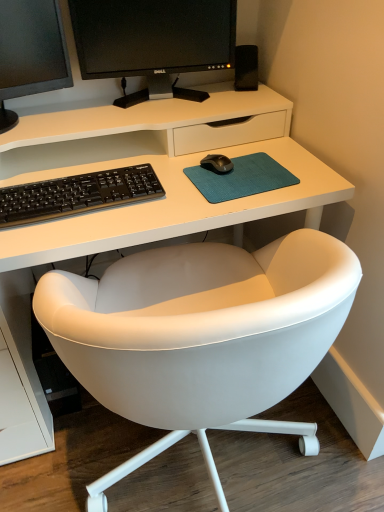
From the picture: What is the approximate height of black glossy monitor at upper left, the first computer monitor in the left-to-right sequence?

The height of black glossy monitor at upper left, the first computer monitor in the left-to-right sequence, is 12.03 inches.

Measure the distance between point (18,7) and camera.

The distance of point (18,7) from camera is 3.48 feet.

The image size is (384, 512). I want to click on teal fabric mousepad at center, so click(x=241, y=178).

At what (x,y) coordinates should I click in order to perform the action: click on white leather chair at center. Please return your answer as a coordinate pair (x, y). Looking at the image, I should click on (201, 336).

Image resolution: width=384 pixels, height=512 pixels. In order to click on black matte keyboard at center in this screenshot , I will do `click(77, 194)`.

Is black matte keyboard at center with teal fabric mousepad at center?

No.

From their relative heights in the image, would you say black matte keyboard at center is taller or shorter than teal fabric mousepad at center?

Considering their sizes, black matte keyboard at center has more height than teal fabric mousepad at center.

Can you confirm if black matte keyboard at center is bigger than teal fabric mousepad at center?

Correct, black matte keyboard at center is larger in size than teal fabric mousepad at center.

From the image's perspective, is black matte keyboard at center on teal fabric mousepad at center?

No.

From a real-world perspective, is black glossy monitor at upper left, which is counted as the second computer monitor, starting from the right, physically located above or below teal fabric mousepad at center?

black glossy monitor at upper left, which is counted as the second computer monitor, starting from the right, is above teal fabric mousepad at center.

From the image's perspective, which computer monitor is the 1st one above the teal fabric mousepad at center? Please provide its 2D coordinates.

[(30, 52)]

How many degrees apart are the facing directions of black glossy monitor at upper left, which is counted as the second computer monitor, starting from the right, and teal fabric mousepad at center?

10.8 degrees separate the facing orientations of black glossy monitor at upper left, which is counted as the second computer monitor, starting from the right, and teal fabric mousepad at center.

Between point (55, 70) and point (270, 165), which one is positioned behind?

The point (55, 70) is farther.

Could you tell me if black matte speaker at upper right is turned towards teal fabric mousepad at center?

Yes, black matte speaker at upper right is aimed at teal fabric mousepad at center.

Which is correct: black matte speaker at upper right is inside teal fabric mousepad at center, or outside of it?

black matte speaker at upper right is outside teal fabric mousepad at center.

In the scene shown: Which of these two, black matte speaker at upper right or teal fabric mousepad at center, stands shorter?

Standing shorter between the two is teal fabric mousepad at center.

Is black glossy monitor at upper left, which is counted as the second computer monitor, starting from the right, behind black glossy monitor at upper center, marked as the 1th computer monitor in a right-to-left arrangement?

That is False.

Considering the sizes of objects black glossy monitor at upper left, the first computer monitor in the left-to-right sequence, and black glossy monitor at upper center, marked as the 1th computer monitor in a right-to-left arrangement, in the image provided, who is bigger, black glossy monitor at upper left, the first computer monitor in the left-to-right sequence, or black glossy monitor at upper center, marked as the 1th computer monitor in a right-to-left arrangement,?

With larger size is black glossy monitor at upper left, the first computer monitor in the left-to-right sequence.

Would you say black glossy monitor at upper left, which is counted as the second computer monitor, starting from the right, contains black glossy monitor at upper center, arranged as the 2th computer monitor when viewed from the left?

Actually, black glossy monitor at upper center, arranged as the 2th computer monitor when viewed from the left, is outside black glossy monitor at upper left, which is counted as the second computer monitor, starting from the right.

Is black glossy monitor at upper left, the first computer monitor in the left-to-right sequence, touching black glossy monitor at upper center, arranged as the 2th computer monitor when viewed from the left?

There is a gap between black glossy monitor at upper left, the first computer monitor in the left-to-right sequence, and black glossy monitor at upper center, arranged as the 2th computer monitor when viewed from the left.

Which computer monitor is the 2nd one when counting from the left side of the white leather chair at center? Please provide its 2D coordinates.

[(30, 52)]

Looking at this image, which is more to the right, black glossy monitor at upper left, which is counted as the second computer monitor, starting from the right, or white leather chair at center?

white leather chair at center is more to the right.

In the scene shown: From the image's perspective, between black glossy monitor at upper left, which is counted as the second computer monitor, starting from the right, and white leather chair at center, who is located below?

white leather chair at center.

Consider the image. How distant is black glossy monitor at upper left, the first computer monitor in the left-to-right sequence, from white leather chair at center?

27.81 inches.

Find the location of a particular element. This screenshot has height=512, width=384. computer keyboard that appears in front of the black glossy monitor at upper center, marked as the 1th computer monitor in a right-to-left arrangement is located at coordinates (77, 194).

What's the angular difference between black matte keyboard at center and black glossy monitor at upper center, arranged as the 2th computer monitor when viewed from the left,'s facing directions?

11.1 degrees.

From the image's perspective, is black matte keyboard at center positioned above or below black glossy monitor at upper center, arranged as the 2th computer monitor when viewed from the left?

Clearly, from the image's perspective, black matte keyboard at center is below black glossy monitor at upper center, arranged as the 2th computer monitor when viewed from the left.

Can you confirm if black matte keyboard at center is positioned to the left of black glossy monitor at upper center, arranged as the 2th computer monitor when viewed from the left?

Correct, you'll find black matte keyboard at center to the left of black glossy monitor at upper center, arranged as the 2th computer monitor when viewed from the left.

At what (x,y) coordinates should I click in order to perform the action: click on computer keyboard in front of the black glossy monitor at upper left, the first computer monitor in the left-to-right sequence. Please return your answer as a coordinate pair (x, y). The height and width of the screenshot is (512, 384). Looking at the image, I should click on (77, 194).

Is black matte keyboard at center not near black glossy monitor at upper left, which is counted as the second computer monitor, starting from the right?

No, black matte keyboard at center is not far from black glossy monitor at upper left, which is counted as the second computer monitor, starting from the right.

Is black glossy monitor at upper left, the first computer monitor in the left-to-right sequence, a part of black matte keyboard at center?

No, black glossy monitor at upper left, the first computer monitor in the left-to-right sequence, is located outside of black matte keyboard at center.

What's the angular difference between black matte keyboard at center and black glossy monitor at upper left, the first computer monitor in the left-to-right sequence,'s facing directions?

15.2 degrees separate the facing orientations of black matte keyboard at center and black glossy monitor at upper left, the first computer monitor in the left-to-right sequence.

What are the coordinates of `computer keyboard that is above the teal fabric mousepad at center (from a real-world perspective)` in the screenshot? It's located at (77, 194).

Which computer monitor is the 2nd one when counting from the left side of the teal fabric mousepad at center? Please provide its 2D coordinates.

[(30, 52)]

When comparing their distances from black glossy monitor at upper center, arranged as the 2th computer monitor when viewed from the left, does white leather chair at center or black matte speaker at upper right seem closer?

Among the two, black matte speaker at upper right is located nearer to black glossy monitor at upper center, arranged as the 2th computer monitor when viewed from the left.

Based on their spatial positions, is teal fabric mousepad at center or white leather chair at center closer to black glossy monitor at upper left, which is counted as the second computer monitor, starting from the right?

Based on the image, teal fabric mousepad at center appears to be nearer to black glossy monitor at upper left, which is counted as the second computer monitor, starting from the right.

In the scene shown: From the image, which object appears to be nearer to teal fabric mousepad at center, white leather chair at center or black glossy monitor at upper left, the first computer monitor in the left-to-right sequence?

white leather chair at center.

Considering their positions, is black matte speaker at upper right positioned closer to black glossy monitor at upper left, which is counted as the second computer monitor, starting from the right, than black glossy monitor at upper center, arranged as the 2th computer monitor when viewed from the left?

black glossy monitor at upper center, arranged as the 2th computer monitor when viewed from the left, lies closer to black glossy monitor at upper left, which is counted as the second computer monitor, starting from the right, than the other object.

From the image, which object appears to be nearer to teal fabric mousepad at center, white leather chair at center or black matte keyboard at center?

Based on the image, black matte keyboard at center appears to be nearer to teal fabric mousepad at center.

Considering their positions, is teal fabric mousepad at center positioned closer to black glossy monitor at upper center, marked as the 1th computer monitor in a right-to-left arrangement, than black matte speaker at upper right?

Based on the image, black matte speaker at upper right appears to be nearer to black glossy monitor at upper center, marked as the 1th computer monitor in a right-to-left arrangement.

From the picture: Looking at the image, which one is located further to black glossy monitor at upper center, marked as the 1th computer monitor in a right-to-left arrangement, black matte speaker at upper right or teal fabric mousepad at center?

teal fabric mousepad at center is further to black glossy monitor at upper center, marked as the 1th computer monitor in a right-to-left arrangement.

Estimate the real-world distances between objects in this image. Which object is closer to black matte keyboard at center, black glossy monitor at upper left, which is counted as the second computer monitor, starting from the right, or teal fabric mousepad at center?

teal fabric mousepad at center is positioned closer to the anchor black matte keyboard at center.

Locate an element on the screen. computer keyboard between black glossy monitor at upper left, which is counted as the second computer monitor, starting from the right, and white leather chair at center in the up-down direction is located at coordinates (77, 194).

Identify the location of computer keyboard between black glossy monitor at upper left, the first computer monitor in the left-to-right sequence, and black matte speaker at upper right, in the horizontal direction. (77, 194).

Locate an element on the screen. The image size is (384, 512). mousepad between black glossy monitor at upper left, the first computer monitor in the left-to-right sequence, and white leather chair at center vertically is located at coordinates (241, 178).

Image resolution: width=384 pixels, height=512 pixels. Find the location of `mousepad between black glossy monitor at upper center, marked as the 1th computer monitor in a right-to-left arrangement, and white leather chair at center in the up-down direction`. mousepad between black glossy monitor at upper center, marked as the 1th computer monitor in a right-to-left arrangement, and white leather chair at center in the up-down direction is located at coordinates (241, 178).